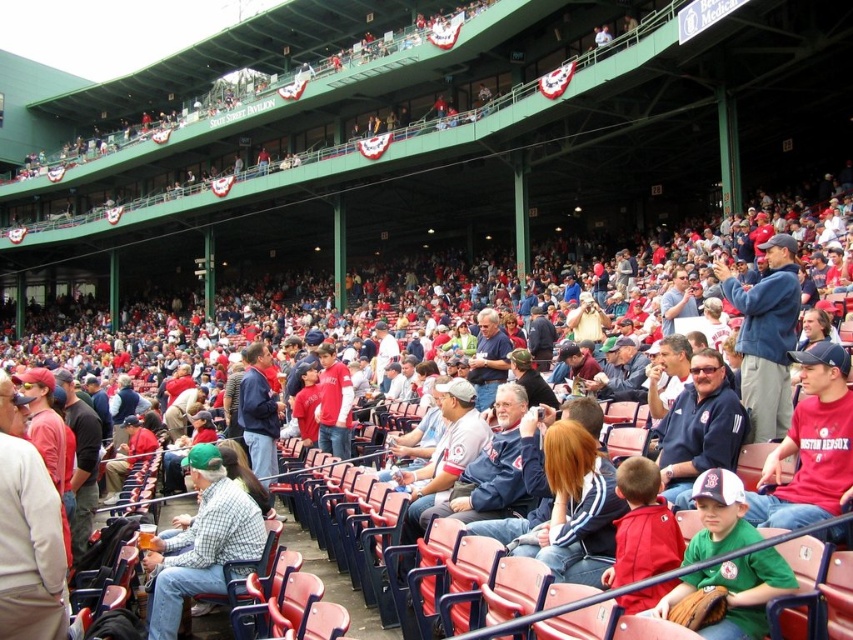
Measure the distance from checkered fabric shirt at center to green jersey at center.

checkered fabric shirt at center is 16.17 meters away from green jersey at center.

The width and height of the screenshot is (853, 640). Describe the element at coordinates (201, 541) in the screenshot. I see `checkered fabric shirt at center` at that location.

Where is `checkered fabric shirt at center`? checkered fabric shirt at center is located at coordinates (201, 541).